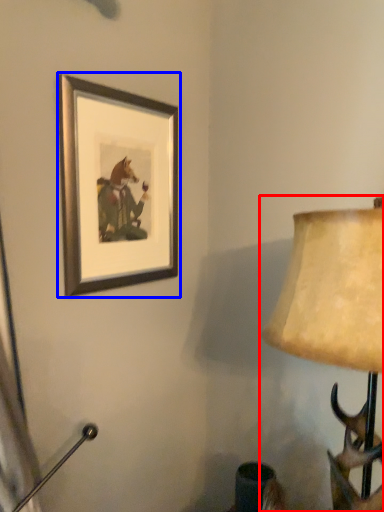
Question: Which of the following is the closest to the observer, lamp (highlighted by a red box) or picture frame (highlighted by a blue box)?

Choices:
 (A) lamp
 (B) picture frame

Answer: (A)